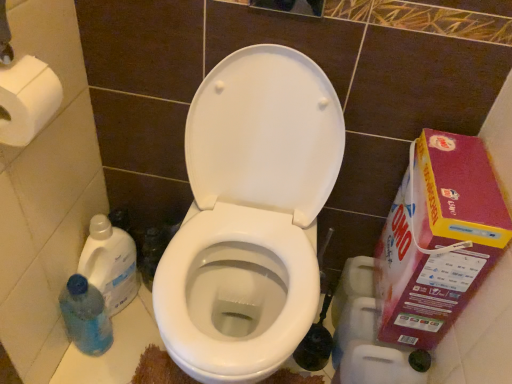
Question: From their relative heights in the image, would you say white matte toilet paper at upper left is taller or shorter than pink cardboard box at right?

Choices:
 (A) short
 (B) tall

Answer: (A)

Question: From a real-world perspective, is white matte toilet paper at upper left above or below pink cardboard box at right?

Choices:
 (A) above
 (B) below

Answer: (A)

Question: Estimate the real-world distances between objects in this image. Which object is closer to the blue translucent bottle at lower left, which ranks as the 2th cleaning product in top-to-bottom order?

Choices:
 (A) blue translucent bottle at lower left, positioned as the 1th cleaning product in top-to-bottom order
 (B) white glossy toilet at center
 (C) pink cardboard box at right
 (D) white matte toilet paper at upper left

Answer: (A)

Question: Which is farther from the blue translucent bottle at lower left, which ranks as the 2th cleaning product in top-to-bottom order?

Choices:
 (A) blue translucent bottle at lower left, positioned as the 1th cleaning product in top-to-bottom order
 (B) pink cardboard box at right
 (C) white glossy toilet at center
 (D) white matte toilet paper at upper left

Answer: (B)